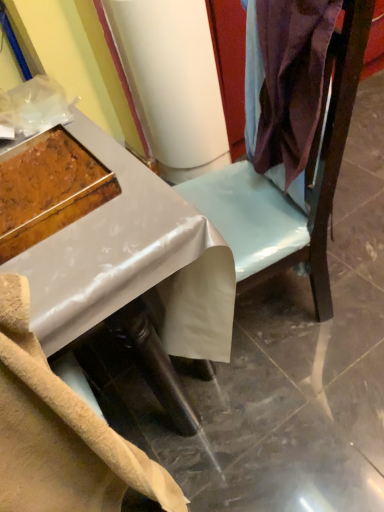
Question: Considering the relative sizes of white glossy desk at center and satin purple fabric at upper right in the image provided, is white glossy desk at center thinner than satin purple fabric at upper right?

Choices:
 (A) no
 (B) yes

Answer: (A)

Question: Is white glossy desk at center aimed at satin purple fabric at upper right?

Choices:
 (A) no
 (B) yes

Answer: (A)

Question: From the image's perspective, would you say white glossy desk at center is shown under satin purple fabric at upper right?

Choices:
 (A) no
 (B) yes

Answer: (B)

Question: Does white glossy desk at center have a larger size compared to satin purple fabric at upper right?

Choices:
 (A) no
 (B) yes

Answer: (B)

Question: Is white glossy desk at center not within satin purple fabric at upper right?

Choices:
 (A) no
 (B) yes

Answer: (B)

Question: Can you confirm if white glossy desk at center is taller than satin purple fabric at upper right?

Choices:
 (A) yes
 (B) no

Answer: (A)

Question: From the image's perspective, is wooden tray at left below white glossy desk at center?

Choices:
 (A) yes
 (B) no

Answer: (B)

Question: Does wooden tray at left appear on the right side of white glossy desk at center?

Choices:
 (A) no
 (B) yes

Answer: (A)

Question: From the image's perspective, does wooden tray at left appear higher than white glossy desk at center?

Choices:
 (A) yes
 (B) no

Answer: (A)

Question: Does wooden tray at left have a lesser height compared to white glossy desk at center?

Choices:
 (A) no
 (B) yes

Answer: (B)

Question: Can you confirm if wooden tray at left is taller than white glossy desk at center?

Choices:
 (A) yes
 (B) no

Answer: (B)

Question: From a real-world perspective, is wooden tray at left beneath white glossy desk at center?

Choices:
 (A) no
 (B) yes

Answer: (A)

Question: From a real-world perspective, is wooden tray at left positioned over satin purple fabric at upper right based on gravity?

Choices:
 (A) yes
 (B) no

Answer: (A)